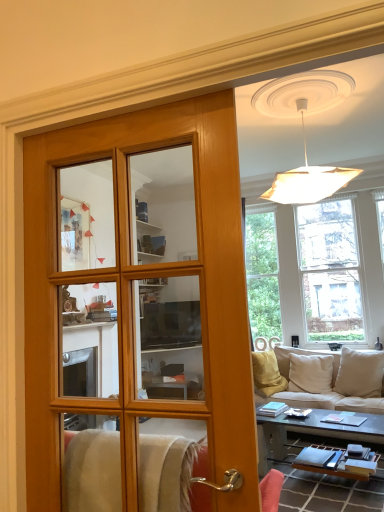
At what (x,y) coordinates should I click in order to perform the action: click on clear glass window at upper right. Please return your answer as a coordinate pair (x, y). The image size is (384, 512). Looking at the image, I should click on (315, 271).

Locate an element on the screen. wooden door at center is located at coordinates (131, 292).

Describe the element at coordinates (131, 292) in the screenshot. I see `wooden door at center` at that location.

The height and width of the screenshot is (512, 384). Identify the location of clear glass window at upper right. point(315,271).

Locate an element on the screen. The width and height of the screenshot is (384, 512). door above the smooth black coffee table at lower right (from the image's perspective) is located at coordinates (131, 292).

Could you tell me if smooth black coffee table at lower right is turned towards wooden door at center?

No, smooth black coffee table at lower right does not turn towards wooden door at center.

From the image's perspective, is smooth black coffee table at lower right on wooden door at center?

Incorrect, from the image's perspective, smooth black coffee table at lower right is lower than wooden door at center.

Are smooth black coffee table at lower right and wooden door at center located far from each other?

That's right, there is a large distance between smooth black coffee table at lower right and wooden door at center.

Consider the image. From a real-world perspective, is beige fabric couch at lower right under smooth black coffee table at lower right?

No, from a real-world perspective, beige fabric couch at lower right is not beneath smooth black coffee table at lower right.

Considering the sizes of beige fabric couch at lower right and smooth black coffee table at lower right in the image, is beige fabric couch at lower right wider or thinner than smooth black coffee table at lower right?

In the image, beige fabric couch at lower right appears to be wider than smooth black coffee table at lower right.

What's the angular difference between beige fabric couch at lower right and smooth black coffee table at lower right's facing directions?

beige fabric couch at lower right and smooth black coffee table at lower right are facing 176 degrees away from each other.

In the scene shown: Could you tell me if beige fabric couch at lower right is turned towards smooth black coffee table at lower right?

Yes, beige fabric couch at lower right is oriented towards smooth black coffee table at lower right.

The height and width of the screenshot is (512, 384). Find the location of `table located on the left of clear glass window at upper right`. table located on the left of clear glass window at upper right is located at coordinates (312, 433).

Considering the positions of objects smooth black coffee table at lower right and clear glass window at upper right in the image provided, who is more to the left, smooth black coffee table at lower right or clear glass window at upper right?

From the viewer's perspective, smooth black coffee table at lower right appears more on the left side.

Considering the sizes of smooth black coffee table at lower right and clear glass window at upper right in the image, is smooth black coffee table at lower right taller or shorter than clear glass window at upper right?

In the image, smooth black coffee table at lower right appears to be shorter than clear glass window at upper right.

From a real-world perspective, which is physically below, smooth black coffee table at lower right or clear glass window at upper right?

smooth black coffee table at lower right.

Would you say clear glass window at upper right is outside smooth black coffee table at lower right?

Absolutely, clear glass window at upper right is external to smooth black coffee table at lower right.

In the scene shown: Can you tell me how much clear glass window at upper right and smooth black coffee table at lower right differ in facing direction?

169 degrees.

Which of these two, clear glass window at upper right or smooth black coffee table at lower right, stands shorter?

With less height is smooth black coffee table at lower right.

Is beige fabric couch at lower right beside wooden door at center?

No, beige fabric couch at lower right is not in contact with wooden door at center.

Would you say beige fabric couch at lower right is outside wooden door at center?

That's correct, beige fabric couch at lower right is outside of wooden door at center.

Measure the distance between beige fabric couch at lower right and wooden door at center.

beige fabric couch at lower right and wooden door at center are 10.59 feet apart from each other.

Identify the location of door that is in front of the beige fabric couch at lower right. (131, 292).

Is clear glass window at upper right wider or thinner than wooden door at center?

In the image, clear glass window at upper right appears to be wider than wooden door at center.

The image size is (384, 512). In order to click on window that appears behind the wooden door at center in this screenshot , I will do `click(315, 271)`.

Are clear glass window at upper right and wooden door at center making contact?

No, clear glass window at upper right is not making contact with wooden door at center.

From the image's perspective, is clear glass window at upper right above or below wooden door at center?

clear glass window at upper right is below wooden door at center.

How different are the orientations of beige fabric couch at lower right and clear glass window at upper right in degrees?

15.2 degrees separate the facing orientations of beige fabric couch at lower right and clear glass window at upper right.

How distant is beige fabric couch at lower right from clear glass window at upper right?

beige fabric couch at lower right and clear glass window at upper right are 4.74 feet apart.

Is beige fabric couch at lower right positioned far away from clear glass window at upper right?

Yes, beige fabric couch at lower right and clear glass window at upper right are quite far apart.

I want to click on studio couch that appears below the clear glass window at upper right (from the image's perspective), so [x=337, y=381].

You are a GUI agent. You are given a task and a screenshot of the screen. Output one action in this format:
    pyautogui.click(x=<x>, y=<y>)
    Task: Click on the table beneath the wooden door at center (from a real-world perspective)
    
    Given the screenshot: What is the action you would take?
    pyautogui.click(x=312, y=433)

Locate an element on the screen. The height and width of the screenshot is (512, 384). table on the left of beige fabric couch at lower right is located at coordinates (312, 433).

Which object lies nearer to the anchor point beige fabric couch at lower right, clear glass window at upper right or smooth black coffee table at lower right?

smooth black coffee table at lower right is positioned closer to the anchor beige fabric couch at lower right.

From the image, which object appears to be farther from clear glass window at upper right, wooden door at center or smooth black coffee table at lower right?

Based on the image, wooden door at center appears to be further to clear glass window at upper right.

From the image, which object appears to be nearer to smooth black coffee table at lower right, beige fabric couch at lower right or clear glass window at upper right?

Based on the image, beige fabric couch at lower right appears to be nearer to smooth black coffee table at lower right.

Estimate the real-world distances between objects in this image. Which object is further from clear glass window at upper right, beige fabric couch at lower right or smooth black coffee table at lower right?

smooth black coffee table at lower right lies further to clear glass window at upper right than the other object.

Based on their spatial positions, is clear glass window at upper right or wooden door at center further from beige fabric couch at lower right?

Among the two, wooden door at center is located further to beige fabric couch at lower right.

In the scene shown: From the image, which object appears to be nearer to clear glass window at upper right, beige fabric couch at lower right or wooden door at center?

beige fabric couch at lower right is positioned closer to the anchor clear glass window at upper right.

Looking at the image, which one is located closer to wooden door at center, smooth black coffee table at lower right or beige fabric couch at lower right?

smooth black coffee table at lower right is closer to wooden door at center.

From the image, which object appears to be farther from beige fabric couch at lower right, smooth black coffee table at lower right or clear glass window at upper right?

Among the two, clear glass window at upper right is located further to beige fabric couch at lower right.

Find the location of `table positioned between wooden door at center and clear glass window at upper right from near to far`. table positioned between wooden door at center and clear glass window at upper right from near to far is located at coordinates (312, 433).

This screenshot has width=384, height=512. I want to click on studio couch between wooden door at center and clear glass window at upper right from front to back, so click(x=337, y=381).

The height and width of the screenshot is (512, 384). What are the coordinates of `studio couch between smooth black coffee table at lower right and clear glass window at upper right along the z-axis` in the screenshot? It's located at (337, 381).

The image size is (384, 512). I want to click on table located between wooden door at center and beige fabric couch at lower right in the depth direction, so click(x=312, y=433).